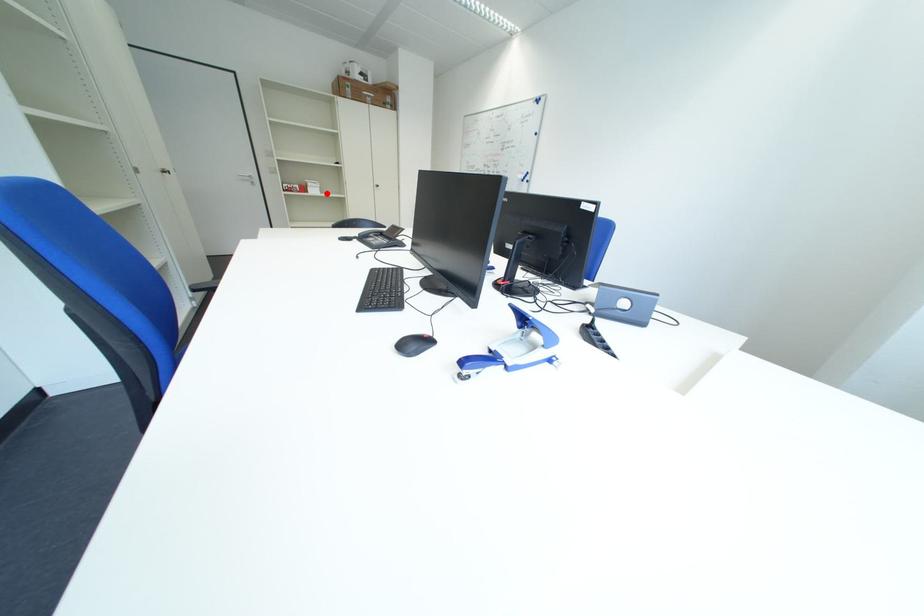
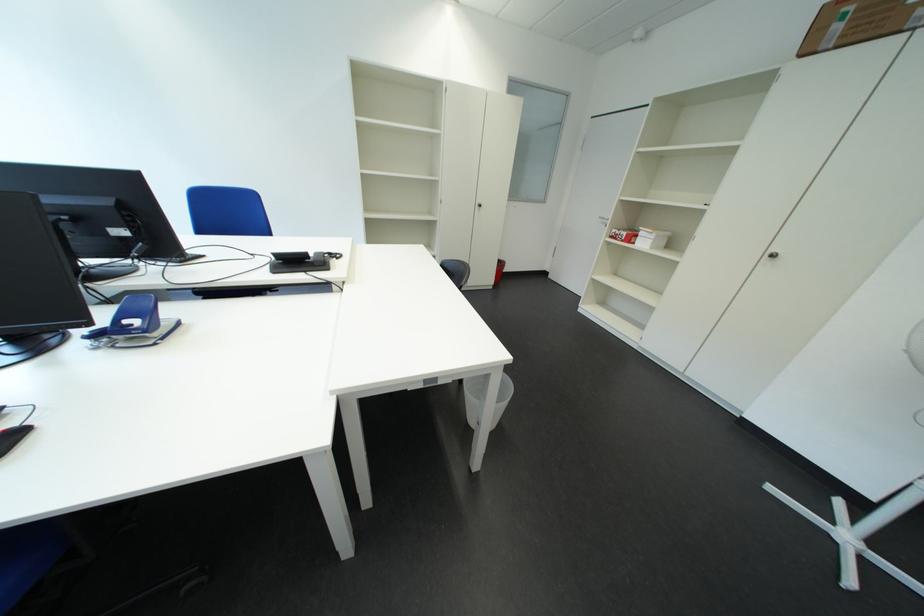
Question: A red point is marked in image1. In image2, is the corresponding 3D point closer to the camera or farther? Reply with the corresponding letter.

Choices:
 (A) The corresponding 3D point is closer.
 (B) The corresponding 3D point is farther.

Answer: (B)